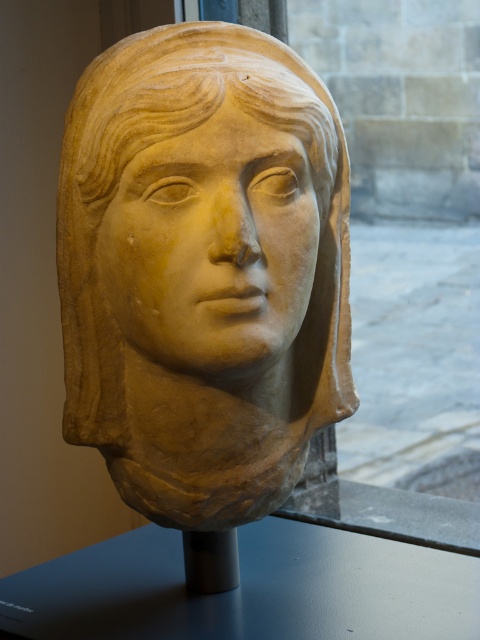
Question: Is beige stone bust at center in front of smooth beige stone face at center?

Choices:
 (A) no
 (B) yes

Answer: (A)

Question: Which of the following is the closest to the observer?

Choices:
 (A) beige stone bust at center
 (B) smooth beige stone face at center

Answer: (B)

Question: Does beige stone bust at center have a smaller size compared to smooth beige stone face at center?

Choices:
 (A) yes
 (B) no

Answer: (B)

Question: Which of the following is the closest to the observer?

Choices:
 (A) smooth beige stone face at center
 (B) beige stone bust at center

Answer: (A)

Question: Is beige stone bust at center wider than smooth beige stone face at center?

Choices:
 (A) no
 (B) yes

Answer: (B)